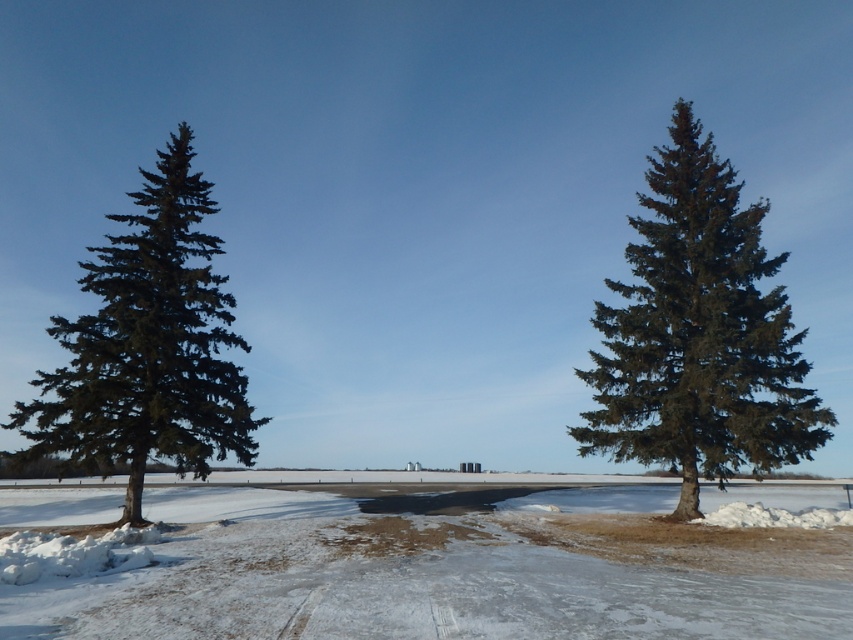
Does white fluffy snow at center appear on the left side of green matte evergreen tree at left?

No, white fluffy snow at center is not to the left of green matte evergreen tree at left.

Is white fluffy snow at center above green matte evergreen tree at left?

Actually, white fluffy snow at center is below green matte evergreen tree at left.

You are a GUI agent. You are given a task and a screenshot of the screen. Output one action in this format:
    pyautogui.click(x=<x>, y=<y>)
    Task: Click on the white fluffy snow at center
    The height and width of the screenshot is (640, 853).
    Given the screenshot: What is the action you would take?
    pyautogui.click(x=415, y=573)

Does white fluffy snow at center have a greater width compared to green matte tree at center?

Yes, white fluffy snow at center is wider than green matte tree at center.

Based on the photo, is white fluffy snow at center above green matte tree at center?

No.

Who is more distant from viewer, (171, 493) or (773, 419)?

The point (171, 493) is more distant.

Locate an element on the screen. white fluffy snow at center is located at coordinates (415, 573).

Which is more to the right, green matte tree at center or green matte evergreen tree at left?

Positioned to the right is green matte tree at center.

Can you confirm if green matte tree at center is positioned to the left of green matte evergreen tree at left?

Incorrect, green matte tree at center is not on the left side of green matte evergreen tree at left.

The width and height of the screenshot is (853, 640). Identify the location of green matte tree at center. point(699,333).